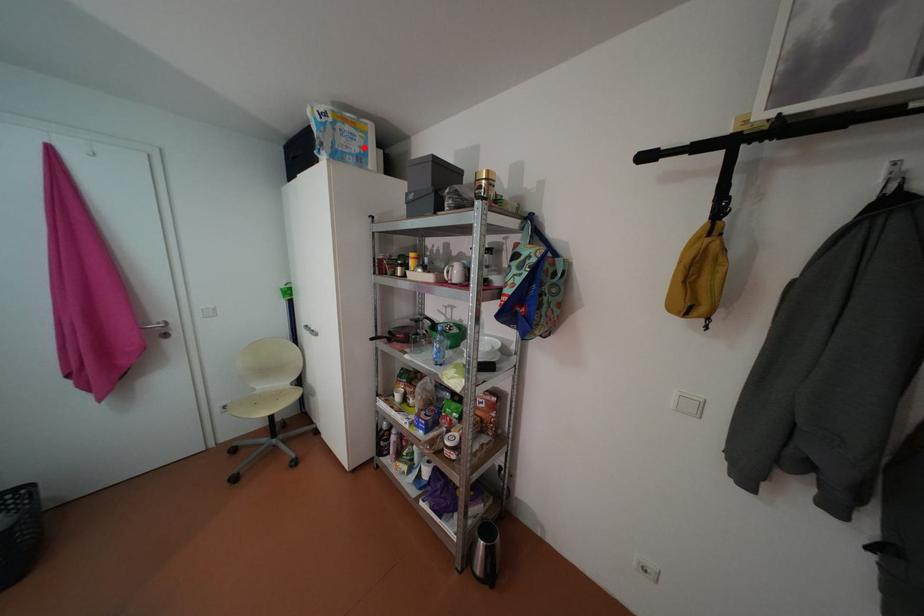
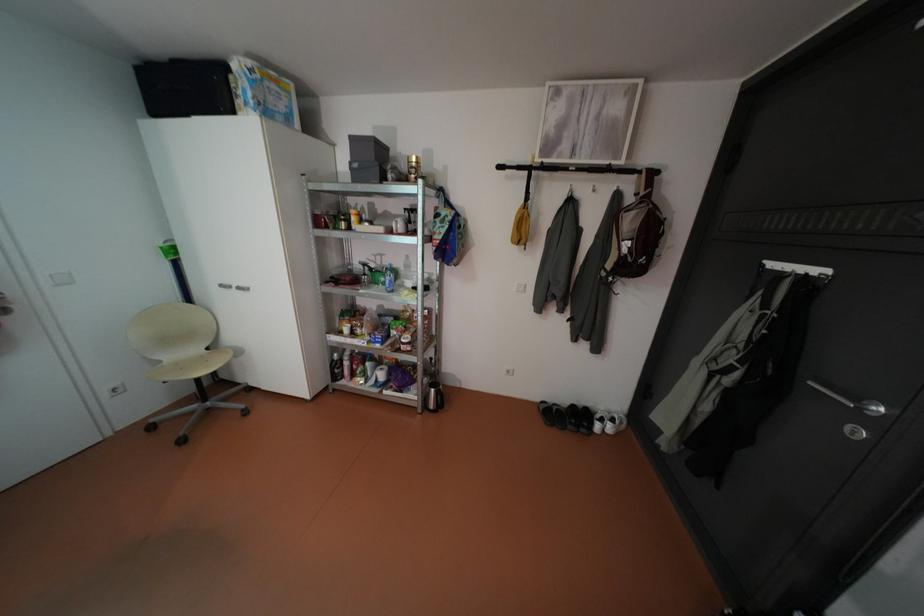
Find the pixel in the second image that matches the highlighted location in the first image.

(290, 107)